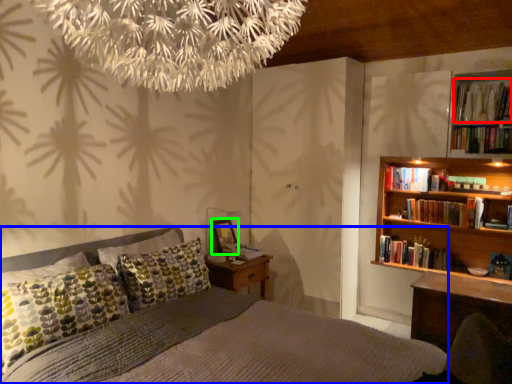
Question: Which is nearer to the book (highlighted by a red box)? bed (highlighted by a blue box) or picture frame (highlighted by a green box).

Choices:
 (A) bed
 (B) picture frame

Answer: (B)